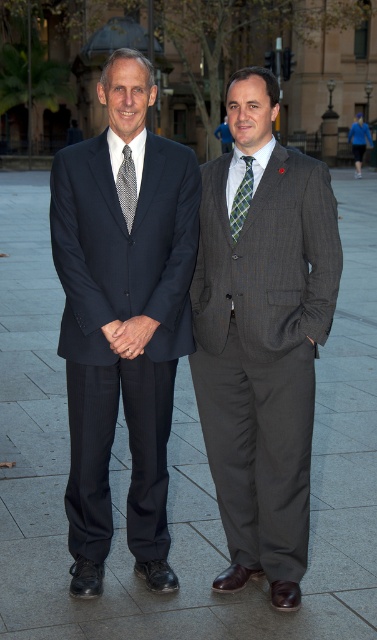
You are standing in front of the two men in the image. You need to place a small sticker exactly at the coordinates point (263, 352). Which man will have the sticker on his clothing?

The point (263, 352) is on the gray pinstripe suit at right, so the sticker will be placed on the man on the right wearing the gray pinstripe suit.

You are a photographer setting up for a formal event. You have two subjects in front of you, a man in a gray pinstripe suit at right and a man wearing a patterned silk tie at center. You need to frame your shot so that both subjects are visible but the focus is on the wider object. Which subject should you focus on?

The gray pinstripe suit at right is wider than the patterned silk tie at center, so you should focus on the gray pinstripe suit at right to prioritize the wider object in your frame.

You are a photographer setting up for a formal event. You need to ensure that the gray pinstripe suit at right and the patterned silk tie at center are both visible in your shot. Given their relative sizes, which object will appear larger in the photo?

The gray pinstripe suit at right is taller than the patterned silk tie at center, so it will appear larger in the photo.